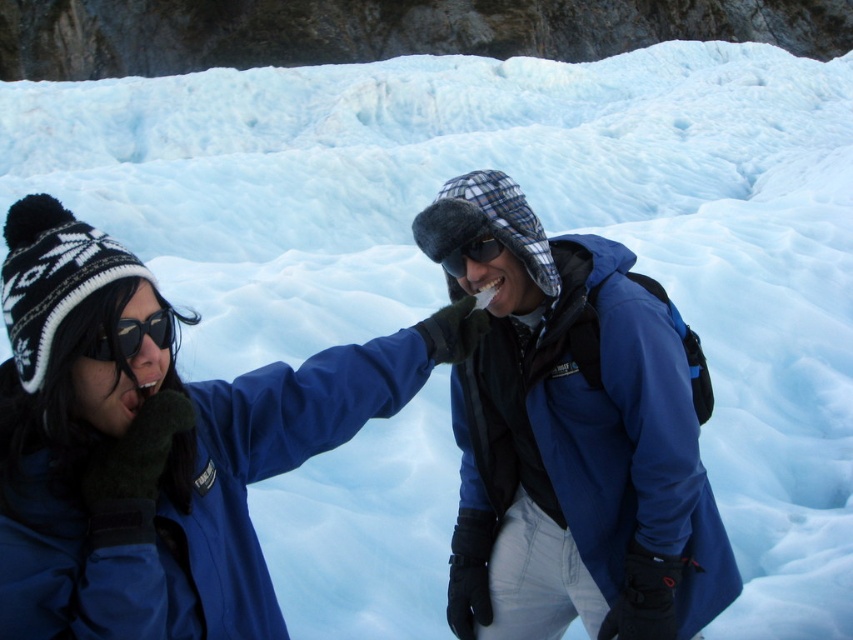
Which is below, matte blue jacket at center or matte black goggles at left?

matte blue jacket at center is lower down.

Does point (33, 342) come closer to viewer compared to point (103, 353)?

Yes, it is in front of point (103, 353).

Does point (102, 589) come closer to viewer compared to point (123, 358)?

Yes, point (102, 589) is closer to viewer.

Image resolution: width=853 pixels, height=640 pixels. Find the location of `matte blue jacket at center`. matte blue jacket at center is located at coordinates (155, 445).

The image size is (853, 640). I want to click on matte blue jacket at center, so click(x=155, y=445).

Locate an element on the screen. Image resolution: width=853 pixels, height=640 pixels. matte blue jacket at center is located at coordinates (155, 445).

Is point (653, 440) positioned in front of point (462, 253)?

Yes, it is.

Looking at this image, can you confirm if blue fleece jacket at center is positioned to the left of black matte goggles at center?

No, blue fleece jacket at center is not to the left of black matte goggles at center.

Is point (561, 276) positioned before point (462, 262)?

That is False.

Locate an element on the screen. blue fleece jacket at center is located at coordinates (572, 438).